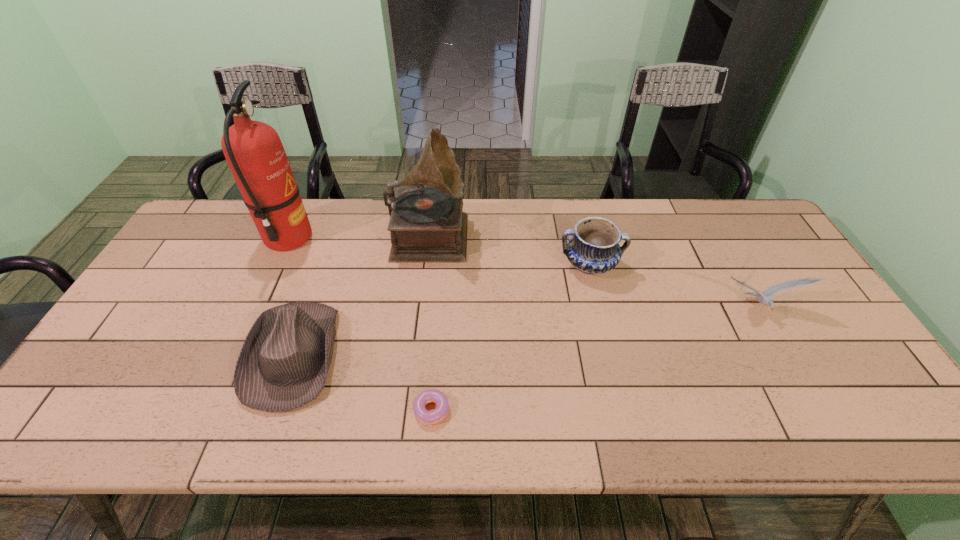
At what (x,y) coordinates should I click in order to perform the action: click on the tallest object. Please return your answer as a coordinate pair (x, y). Looking at the image, I should click on (253, 150).

The width and height of the screenshot is (960, 540). I want to click on the second tallest object, so click(427, 225).

Find the location of a particular element. the fifth object from left to right is located at coordinates (593, 248).

Image resolution: width=960 pixels, height=540 pixels. I want to click on the rightmost object, so [x=766, y=299].

In order to click on fedora in this screenshot , I will do coord(283,364).

This screenshot has height=540, width=960. In order to click on the shortest object in this screenshot , I will do `click(422, 414)`.

This screenshot has height=540, width=960. I want to click on vacant area situated 0.400m on the side of the tallest object with the nozzle and handle, so click(x=438, y=238).

The height and width of the screenshot is (540, 960). I want to click on free space located from the horn of the record player, so click(x=557, y=232).

Where is `blank area located 0.110m on the front of the fifth object from left to right`? The width and height of the screenshot is (960, 540). blank area located 0.110m on the front of the fifth object from left to right is located at coordinates (602, 315).

Where is `free space located at the tip of the beak of the gull`? free space located at the tip of the beak of the gull is located at coordinates (807, 399).